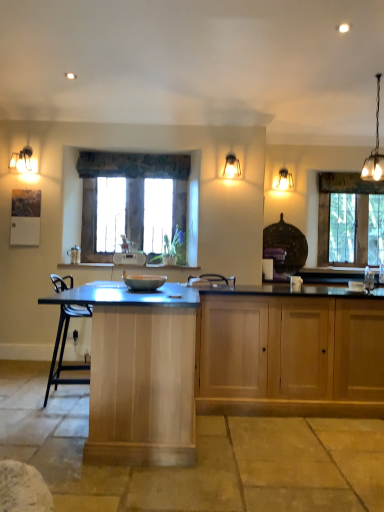
What do you see at coordinates (374, 150) in the screenshot? The image size is (384, 512). I see `metallic chandelier at upper right` at bounding box center [374, 150].

Measure the distance between metallic chandelier at upper right and camera.

metallic chandelier at upper right and camera are 3.95 meters apart.

The width and height of the screenshot is (384, 512). What do you see at coordinates (137, 201) in the screenshot? I see `wooden window at center, which is counted as the second window, starting from the right` at bounding box center [137, 201].

The image size is (384, 512). I want to click on matte glass lampshade at upper center, acting as the 2th lamp starting from the left, so click(x=231, y=167).

In order to face matte glass lampshade at upper center, which is counted as the 2th lamp, starting from the front, should I rotate leftwards or rightwards?

You should look right and rotate roughly 5.411 degrees.

The image size is (384, 512). In order to click on matte white pendant light at upper left, placed as the 3th lamp when sorted from back to front in this screenshot , I will do `click(22, 160)`.

Locate an element on the screen. The width and height of the screenshot is (384, 512). metallic chandelier at upper right is located at coordinates (374, 150).

Considering the relative sizes of light wood cabinet at center, which is the first cabinetry in left-to-right order, and wooden cabinet at lower right, which is the second cabinetry in left-to-right order, in the image provided, is light wood cabinet at center, which is the first cabinetry in left-to-right order, smaller than wooden cabinet at lower right, which is the second cabinetry in left-to-right order,?

No.

Which point is more distant from viewer, (92, 353) or (207, 359)?

Positioned behind is point (207, 359).

Does light wood cabinet at center, marked as the 2th cabinetry in a right-to-left arrangement, have a greater width compared to wooden cabinet at lower right, which is the second cabinetry in left-to-right order?

Indeed, light wood cabinet at center, marked as the 2th cabinetry in a right-to-left arrangement, has a greater width compared to wooden cabinet at lower right, which is the second cabinetry in left-to-right order.

Could you measure the distance between light wood cabinet at center, marked as the 2th cabinetry in a right-to-left arrangement, and wooden cabinet at lower right, which is the second cabinetry in left-to-right order?

The distance of light wood cabinet at center, marked as the 2th cabinetry in a right-to-left arrangement, from wooden cabinet at lower right, which is the second cabinetry in left-to-right order, is 36.10 inches.

From the picture: Is matte glass lampshade at upper center, the 2th lamp when ordered from back to front, facing away from wooden window at center, the 2th window from the back?

matte glass lampshade at upper center, the 2th lamp when ordered from back to front, does not have its back to wooden window at center, the 2th window from the back.

This screenshot has height=512, width=384. What are the coordinates of `window that is the 1st one when counting downward from the matte glass lampshade at upper center, the 2th lamp when ordered from back to front (from the image's perspective)` in the screenshot? It's located at (137, 201).

What's the angular difference between matte glass lampshade at upper center, the 2th lamp when ordered from back to front, and wooden window at center, which is counted as the second window, starting from the right,'s facing directions?

The angular difference between matte glass lampshade at upper center, the 2th lamp when ordered from back to front, and wooden window at center, which is counted as the second window, starting from the right, is 1.82 degrees.

Is matte glass lampshade at upper center, which is counted as the 2th lamp, starting from the front, touching wooden window at center, which is counted as the second window, starting from the right?

There is a gap between matte glass lampshade at upper center, which is counted as the 2th lamp, starting from the front, and wooden window at center, which is counted as the second window, starting from the right.

Considering the relative sizes of wooden window at center, which is counted as the second window, starting from the right, and matte glass lampshade at upper center, the 2th lamp from the right, in the image provided, is wooden window at center, which is counted as the second window, starting from the right, wider than matte glass lampshade at upper center, the 2th lamp from the right,?

No, wooden window at center, which is counted as the second window, starting from the right, is not wider than matte glass lampshade at upper center, the 2th lamp from the right.

Who is taller, wooden window at center, the 2th window from the back, or matte glass lampshade at upper center, acting as the 2th lamp starting from the left?

wooden window at center, the 2th window from the back.

Between wooden window at center, which is counted as the second window, starting from the right, and matte glass lampshade at upper center, the 2th lamp when ordered from back to front, which one appears on the left side from the viewer's perspective?

wooden window at center, which is counted as the second window, starting from the right, is more to the left.

Where is `the 1st lamp to the right of the wooden window at center, the 1th window from the left, counting from the anchor's position`? The height and width of the screenshot is (512, 384). the 1st lamp to the right of the wooden window at center, the 1th window from the left, counting from the anchor's position is located at coordinates (231, 167).

What's the angular difference between clear glass window at right, arranged as the 2th window when viewed from the left, and metallic chandelier at upper right's facing directions?

The angle between the facing direction of clear glass window at right, arranged as the 2th window when viewed from the left, and the facing direction of metallic chandelier at upper right is 104 degrees.

Considering the positions of points (326, 190) and (372, 180), is point (326, 190) farther from camera compared to point (372, 180)?

Yes, point (326, 190) is farther from viewer.

Could you tell me if clear glass window at right, marked as the 1th window in a back-to-front arrangement, is turned towards metallic chandelier at upper right?

Yes, clear glass window at right, marked as the 1th window in a back-to-front arrangement, is facing metallic chandelier at upper right.

There is a clear glass window at right, marked as the 1th window in a back-to-front arrangement. Where is `light fixture above it (from a real-world perspective)`? light fixture above it (from a real-world perspective) is located at coordinates (374, 150).

Is matte glass lampshade at upper center, the 2th lamp from the right, taller or shorter than matte white pendant light at upper left, which is the third lamp from right to left?

In the image, matte glass lampshade at upper center, the 2th lamp from the right, appears to be shorter than matte white pendant light at upper left, which is the third lamp from right to left.

In terms of width, does matte glass lampshade at upper center, the 2th lamp when ordered from back to front, look wider or thinner when compared to matte white pendant light at upper left, which is the third lamp from right to left?

In the image, matte glass lampshade at upper center, the 2th lamp when ordered from back to front, appears to be more narrow than matte white pendant light at upper left, which is the third lamp from right to left.

Based on the photo, which is more to the right, matte glass lampshade at upper center, the 2th lamp when ordered from back to front, or matte white pendant light at upper left, which is the third lamp from right to left?

From the viewer's perspective, matte glass lampshade at upper center, the 2th lamp when ordered from back to front, appears more on the right side.

Choose the correct answer: Is matte glass lampshade at upper center, the 2th lamp when ordered from back to front, inside matte white pendant light at upper left, the 1th lamp from the front, or outside it?

The correct answer is: outside.

What's the angular difference between metallic chandelier at upper right and clear glass window at right, marked as the 1th window in a back-to-front arrangement,'s facing directions?

104 degrees.

Looking at this image, which of these two, metallic chandelier at upper right or clear glass window at right, which is counted as the 2th window, starting from the front, is bigger?

Bigger between the two is clear glass window at right, which is counted as the 2th window, starting from the front.

From a real-world perspective, which object rests below the other?

In real-world perspective, clear glass window at right, which is counted as the 2th window, starting from the front, is lower.

Based on the photo, between metallic chandelier at upper right and clear glass window at right, which is the 1th window from right to left, which one has larger width?

Wider between the two is metallic chandelier at upper right.

From the image's perspective, is clear glass window at right, which is counted as the 2th window, starting from the front, positioned above or below wooden window at center, the 2th window from the back?

clear glass window at right, which is counted as the 2th window, starting from the front, is below wooden window at center, the 2th window from the back.

Is clear glass window at right, which is the 1th window from right to left, situated inside wooden window at center, the 1th window from the left, or outside?

The correct answer is: outside.

Is clear glass window at right, marked as the 1th window in a back-to-front arrangement, bigger than wooden window at center, which is counted as the second window, starting from the right?

Actually, clear glass window at right, marked as the 1th window in a back-to-front arrangement, might be smaller than wooden window at center, which is counted as the second window, starting from the right.

The width and height of the screenshot is (384, 512). I want to click on cabinetry above the wooden cabinet at lower right, which is the first cabinetry from right to left (from a real-world perspective), so click(140, 373).

From the wooden window at center, which appears as the first window when viewed from the front, count 1st lamp to the right and point to it. Please provide its 2D coordinates.

[(231, 167)]

When comparing their distances from wooden cabinet at lower right, which is the second cabinetry in left-to-right order, does wooden window at center, the 2th window from the back, or metallic chandelier at upper right seem further?

metallic chandelier at upper right is positioned further to the anchor wooden cabinet at lower right, which is the second cabinetry in left-to-right order.

Looking at the image, which one is located further to matte glass lampshade at upper center, the 2th lamp from the right, metallic chandelier at upper right or matte glass pendant light at upper right, acting as the third lamp starting from the front?

The object further to matte glass lampshade at upper center, the 2th lamp from the right, is metallic chandelier at upper right.

When comparing their distances from matte glass lampshade at upper center, the 2th lamp from the right, does matte gray bowl at center or wooden window at center, the 2th window from the back, seem closer?

wooden window at center, the 2th window from the back, is positioned closer to the anchor matte glass lampshade at upper center, the 2th lamp from the right.

Estimate the real-world distances between objects in this image. Which object is closer to matte glass lampshade at upper center, the 2th lamp from the right, matte gray bowl at center or light wood cabinet at center, marked as the 2th cabinetry in a right-to-left arrangement?

matte gray bowl at center lies closer to matte glass lampshade at upper center, the 2th lamp from the right, than the other object.

Based on their spatial positions, is light wood cabinet at center, marked as the 2th cabinetry in a right-to-left arrangement, or matte glass pendant light at upper right, placed as the third lamp when sorted from left to right, closer to wooden cabinet at lower right, which is the second cabinetry in left-to-right order?

Among the two, light wood cabinet at center, marked as the 2th cabinetry in a right-to-left arrangement, is located nearer to wooden cabinet at lower right, which is the second cabinetry in left-to-right order.

Estimate the real-world distances between objects in this image. Which object is further from matte gray bowl at center, wooden cabinet at lower right, which is the second cabinetry in left-to-right order, or wooden window at center, which is counted as the second window, starting from the right?

wooden cabinet at lower right, which is the second cabinetry in left-to-right order.

From the image, which object appears to be farther from matte white pendant light at upper left, which is the third lamp from right to left, matte gray bowl at center or wooden cabinet at lower right, which is the first cabinetry from right to left?

wooden cabinet at lower right, which is the first cabinetry from right to left, lies further to matte white pendant light at upper left, which is the third lamp from right to left, than the other object.

Which object lies nearer to the anchor point wooden window at center, which appears as the first window when viewed from the front, matte glass pendant light at upper right, placed as the third lamp when sorted from left to right, or wooden cabinet at lower right, which is the first cabinetry from right to left?

Based on the image, wooden cabinet at lower right, which is the first cabinetry from right to left, appears to be nearer to wooden window at center, which appears as the first window when viewed from the front.

Locate an element on the screen. This screenshot has height=512, width=384. window between matte white pendant light at upper left, placed as the 3th lamp when sorted from back to front, and metallic chandelier at upper right is located at coordinates coord(137,201).

Where is `bowl between matte white pendant light at upper left, which is the third lamp from right to left, and matte glass pendant light at upper right, placed as the third lamp when sorted from left to right`? bowl between matte white pendant light at upper left, which is the third lamp from right to left, and matte glass pendant light at upper right, placed as the third lamp when sorted from left to right is located at coordinates (143, 281).

The image size is (384, 512). Identify the location of cabinetry between light wood cabinet at center, marked as the 2th cabinetry in a right-to-left arrangement, and matte glass pendant light at upper right, the first lamp when ordered from back to front, along the z-axis. (289, 355).

Where is `lamp between light wood cabinet at center, which is the first cabinetry in left-to-right order, and matte glass lampshade at upper center, the 2th lamp from the right, from front to back`? The height and width of the screenshot is (512, 384). lamp between light wood cabinet at center, which is the first cabinetry in left-to-right order, and matte glass lampshade at upper center, the 2th lamp from the right, from front to back is located at coordinates (22, 160).